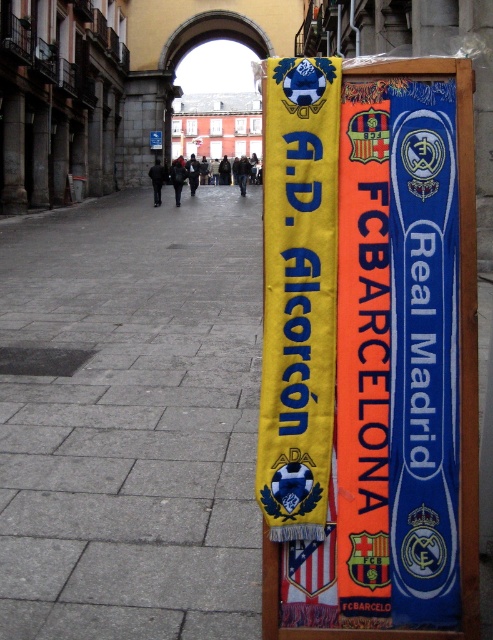
Which is behind, point (60, 580) or point (339, 588)?

Positioned behind is point (60, 580).

Find the location of a particular element. The width and height of the screenshot is (493, 640). gray stone pavement at center is located at coordinates (133, 419).